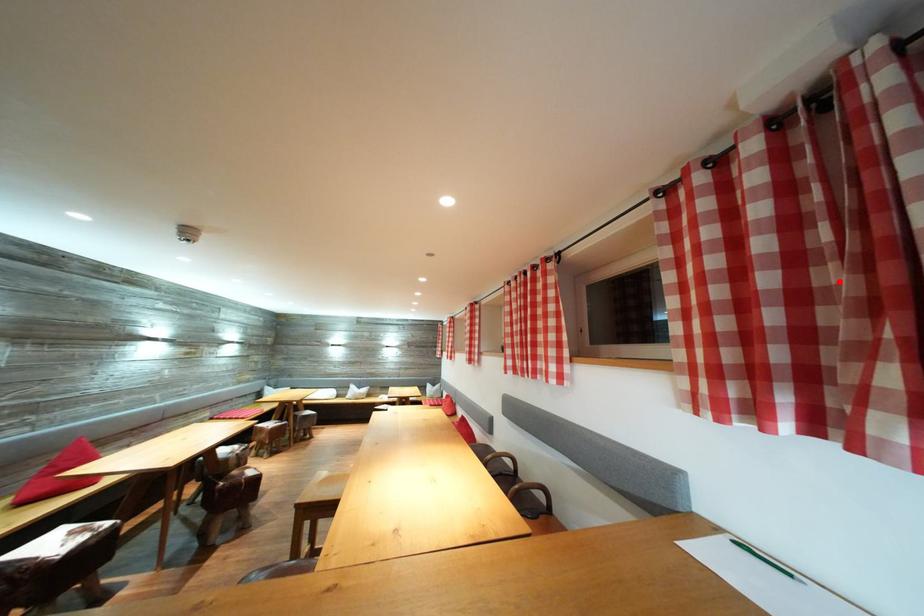
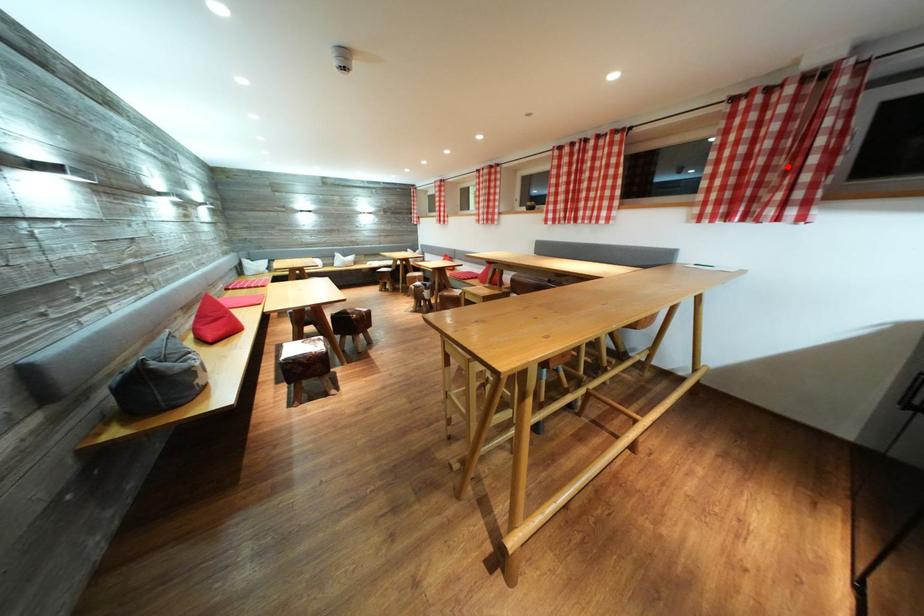
I am providing you with two images of the same scene from different viewpoints. A red point is marked on the first image and another point is marked on the second image. Is the marked point in image1 the same physical position as the marked point in image2?

Yes